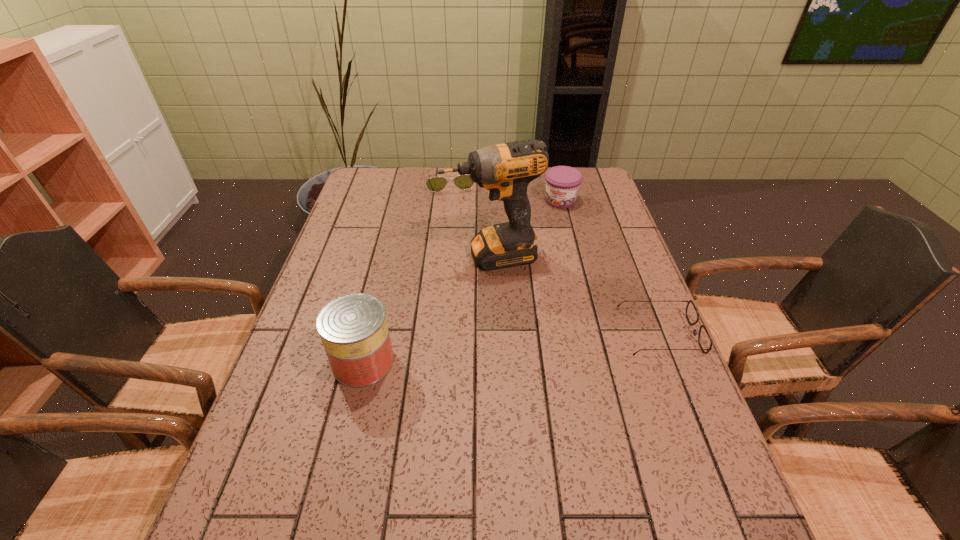
Locate an element on the screen. can is located at coordinates [353, 328].

The width and height of the screenshot is (960, 540). What are the coordinates of `the right sunglasses` in the screenshot? It's located at (704, 339).

What are the coordinates of `the rightmost object` in the screenshot? It's located at (704, 339).

The image size is (960, 540). What are the coordinates of `the second object from right to left` in the screenshot? It's located at (562, 182).

Find the location of `jam`. jam is located at coordinates (562, 182).

Find the location of `drill`. drill is located at coordinates (505, 170).

Find the location of a particular element. Image resolution: width=960 pixels, height=540 pixels. the tallest object is located at coordinates (505, 170).

Find the location of `the farther sunglasses`. the farther sunglasses is located at coordinates (464, 182).

Where is `free space located 0.360m on the right of the second tallest object`? This screenshot has height=540, width=960. free space located 0.360m on the right of the second tallest object is located at coordinates (549, 361).

You are a GUI agent. You are given a task and a screenshot of the screen. Output one action in this format:
    pyautogui.click(x=<x>, y=<y>)
    Task: Click on the vacant point located on the front label of the third shortest object
    This screenshot has width=960, height=540.
    Given the screenshot: What is the action you would take?
    pyautogui.click(x=539, y=249)